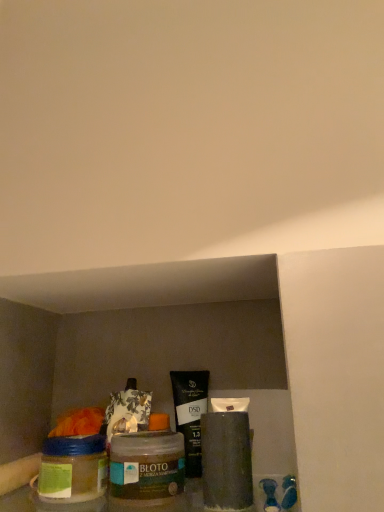
Question: Should I look upward or downward to see matte black tube at center?

Choices:
 (A) up
 (B) down

Answer: (B)

Question: Is translucent glass jar at lower left in contact with matte black tube at center?

Choices:
 (A) no
 (B) yes

Answer: (B)

Question: Does translucent glass jar at lower left lie behind matte black tube at center?

Choices:
 (A) yes
 (B) no

Answer: (A)

Question: Would you say matte black tube at center is part of translucent glass jar at lower left's contents?

Choices:
 (A) no
 (B) yes

Answer: (A)

Question: Is translucent glass jar at lower left aimed at matte black tube at center?

Choices:
 (A) yes
 (B) no

Answer: (B)

Question: Does translucent glass jar at lower left have a smaller size compared to matte black tube at center?

Choices:
 (A) yes
 (B) no

Answer: (B)

Question: Considering the relative sizes of translucent glass jar at lower left and matte black tube at center in the image provided, is translucent glass jar at lower left taller than matte black tube at center?

Choices:
 (A) yes
 (B) no

Answer: (B)

Question: Is black matte tube at center positioned far away from translucent glass jar at lower left?

Choices:
 (A) no
 (B) yes

Answer: (A)

Question: Is black matte tube at center touching translucent glass jar at lower left?

Choices:
 (A) no
 (B) yes

Answer: (B)

Question: Is black matte tube at center bigger than translucent glass jar at lower left?

Choices:
 (A) no
 (B) yes

Answer: (A)

Question: Does black matte tube at center turn towards translucent glass jar at lower left?

Choices:
 (A) no
 (B) yes

Answer: (B)

Question: Considering the relative sizes of black matte tube at center and translucent glass jar at lower left in the image provided, is black matte tube at center smaller than translucent glass jar at lower left?

Choices:
 (A) no
 (B) yes

Answer: (B)

Question: From a real-world perspective, does black matte tube at center sit lower than translucent glass jar at lower left?

Choices:
 (A) no
 (B) yes

Answer: (A)

Question: Is the position of black matte tube at center more distant than that of matte black tube at center?

Choices:
 (A) no
 (B) yes

Answer: (B)